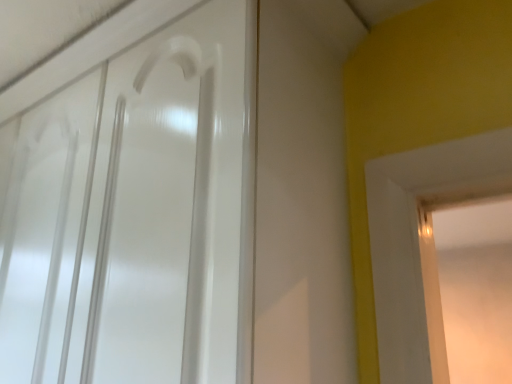
This screenshot has height=384, width=512. Find the location of `white glossy door handle at upper left`. white glossy door handle at upper left is located at coordinates (133, 203).

The image size is (512, 384). Describe the element at coordinates (133, 203) in the screenshot. I see `white glossy door handle at upper left` at that location.

Locate an element on the screen. white glossy door handle at upper left is located at coordinates (133, 203).